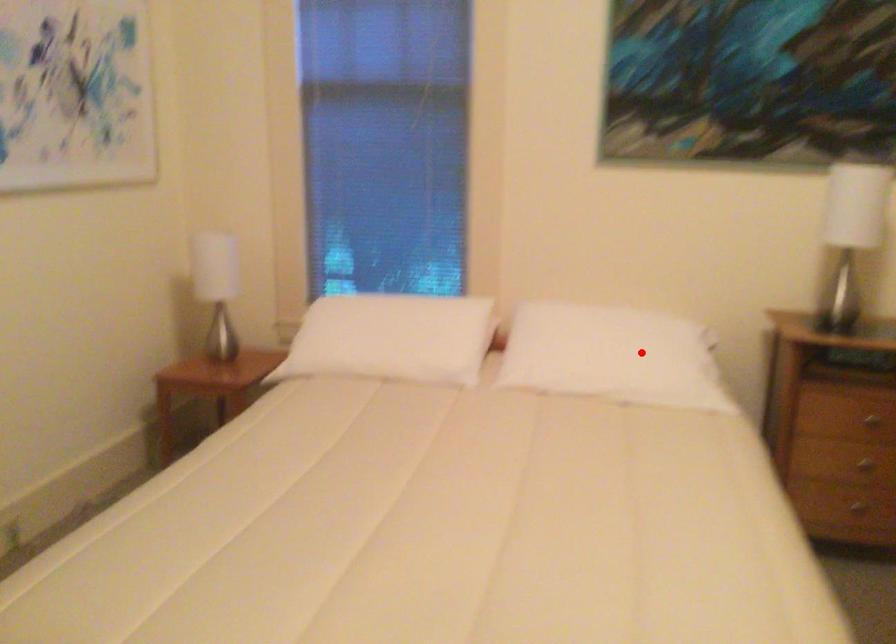
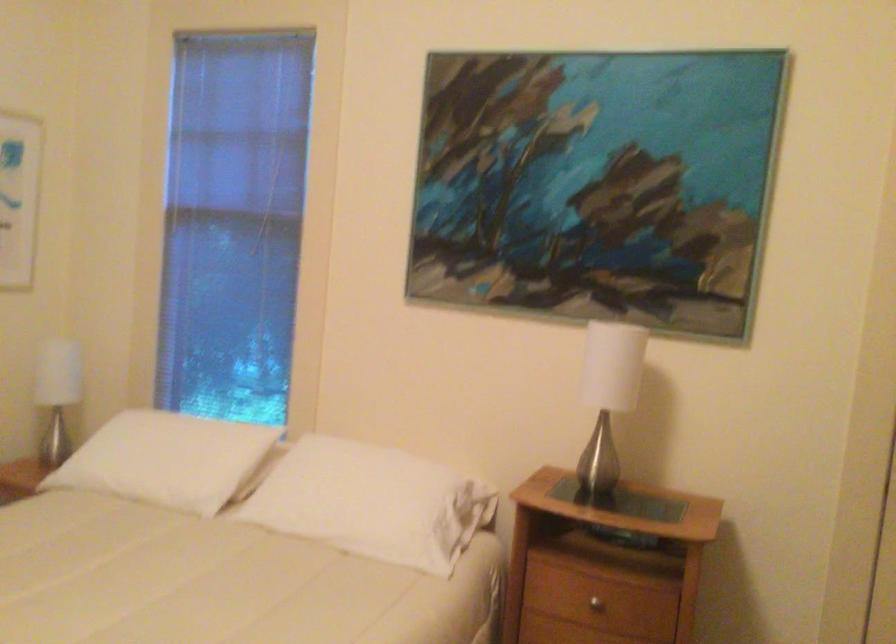
The point at the highlighted location is marked in the first image. Where is the corresponding point in the second image?

(373, 502)